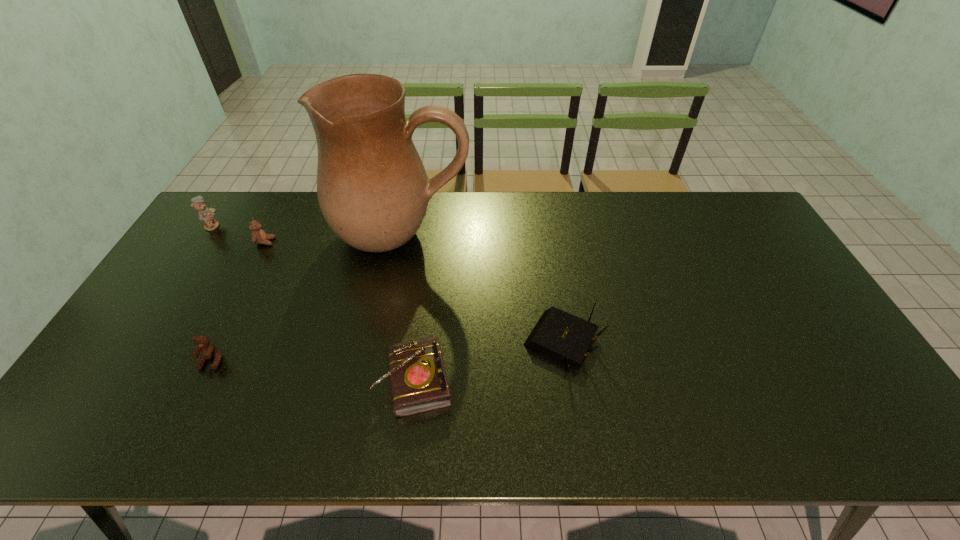
You are a GUI agent. You are given a task and a screenshot of the screen. Output one action in this format:
    pyautogui.click(x=<x>, y=<y>)
    Task: Click on the free spot that satisfies the following two spatial constraints: 1. on the front-facing side of the shortest object; 2. on the left side of the tallest teddy bear
    This screenshot has width=960, height=540.
    Given the screenshot: What is the action you would take?
    pyautogui.click(x=109, y=381)